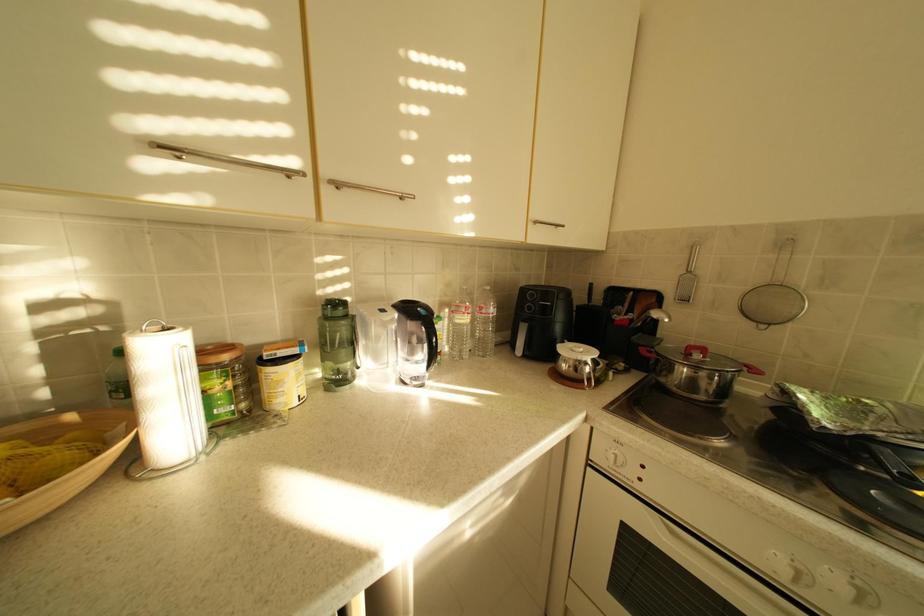
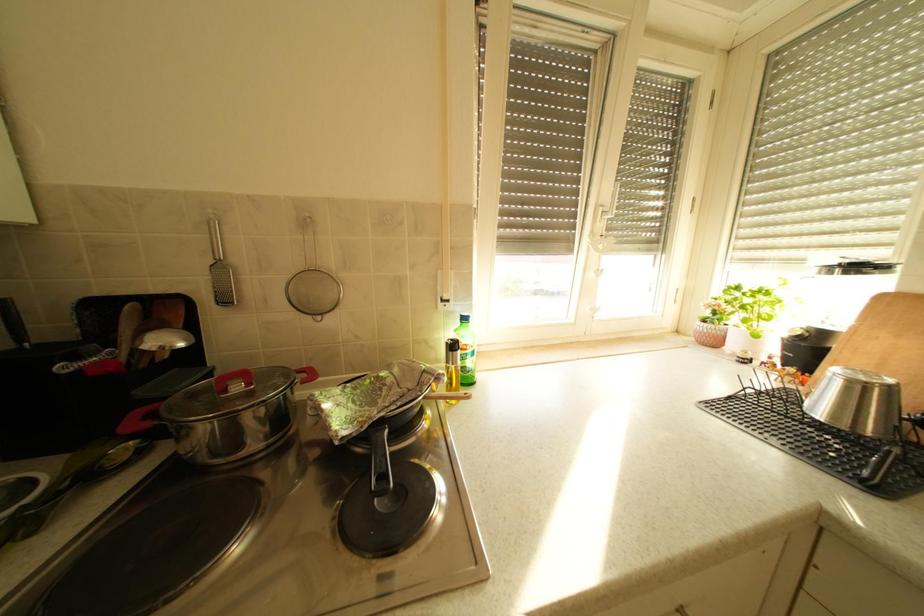
Question: How did the camera likely rotate?

Choices:
 (A) Left
 (B) Right
 (C) Up
 (D) Down

Answer: (B)